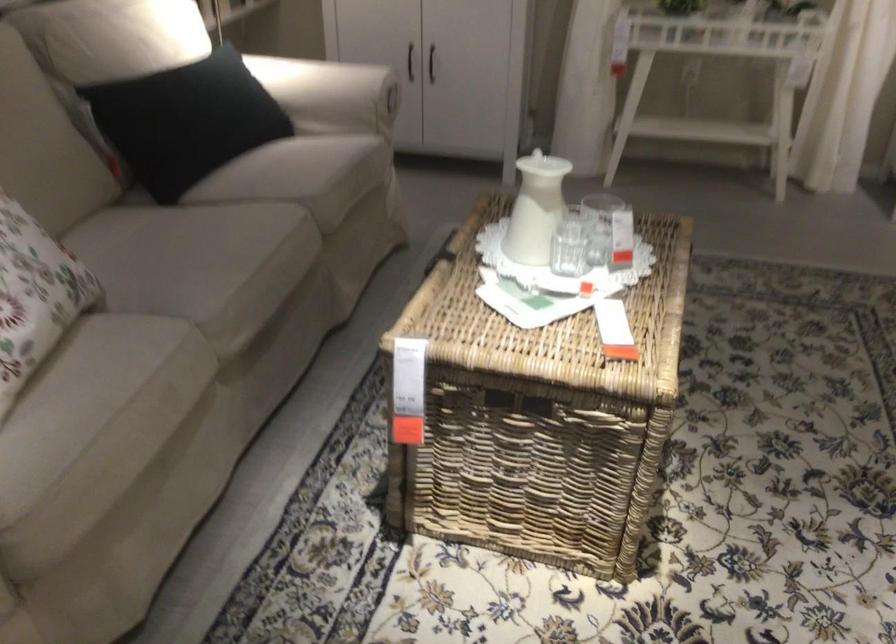
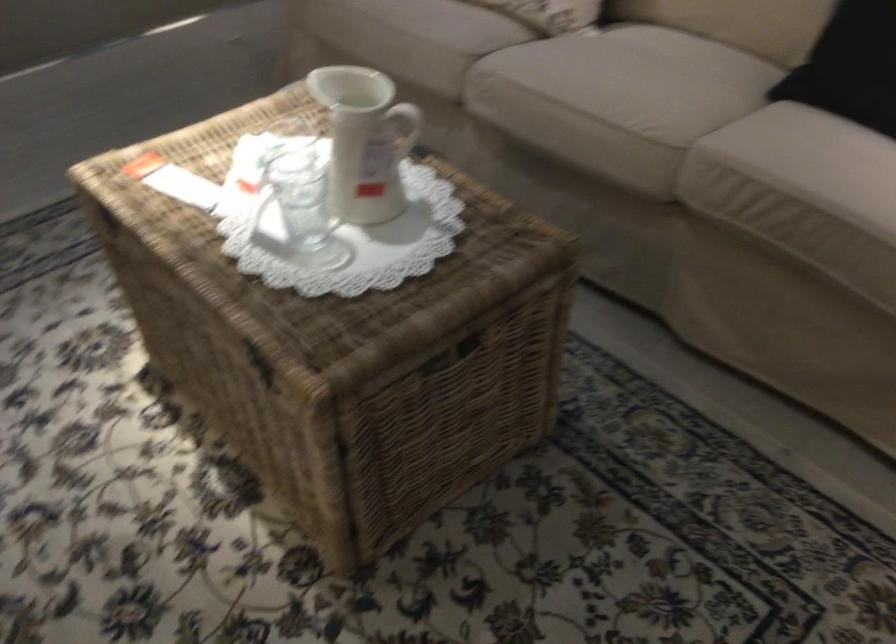
Where in the second image is the point corresponding to pixel 244 241 from the first image?

(617, 93)